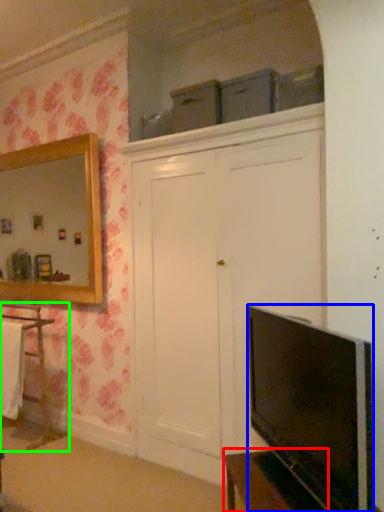
Question: Estimate the real-world distances between objects in this image. Which object is closer to vanity (highlighted by a red box), television (highlighted by a blue box) or cabinetry (highlighted by a green box)?

Choices:
 (A) television
 (B) cabinetry

Answer: (A)